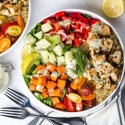
At what (x,y) coordinates should I click in order to perform the action: click on blurry fork. Please return your answer as a coordinate pair (x, y). Looking at the image, I should click on (3, 108), (12, 111), (22, 114), (38, 115), (61, 119), (80, 119), (76, 124).